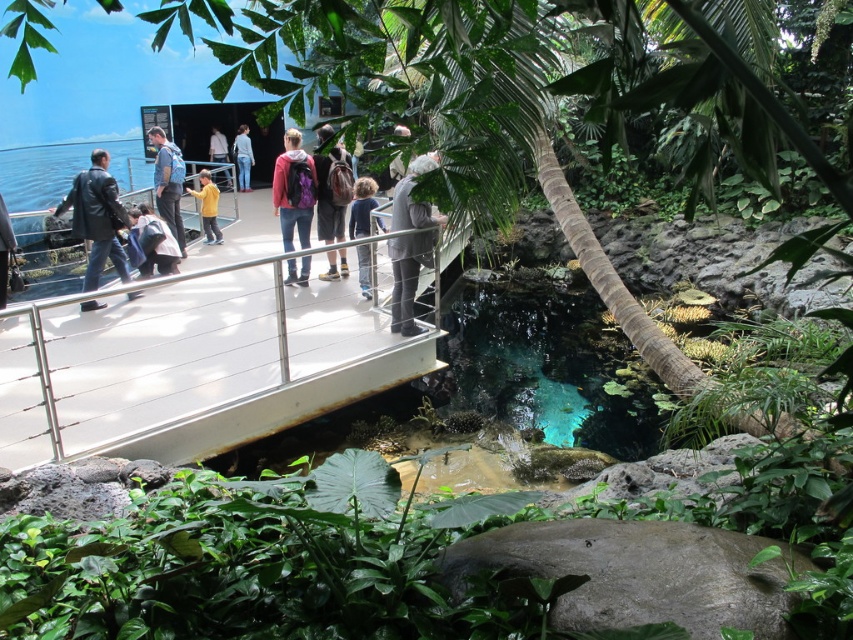
Question: Based on their relative distances, which object is farther from the matte black backpack at center?

Choices:
 (A) blue jeans at center
 (B) light blue backpack at center

Answer: (B)

Question: Can you confirm if dark gray backpack at center is bigger than light blue backpack at center?

Choices:
 (A) no
 (B) yes

Answer: (B)

Question: Can you confirm if dark gray backpack at center is positioned to the left of yellow matte shirt at center?

Choices:
 (A) no
 (B) yes

Answer: (A)

Question: Which object is closer to the camera taking this photo?

Choices:
 (A) purple backpack at center
 (B) light blue backpack at center
 (C) leather jacket at left

Answer: (C)

Question: Does leather jacket at left have a greater width compared to light blue backpack at center?

Choices:
 (A) no
 (B) yes

Answer: (B)

Question: Which object is farther from the camera taking this photo?

Choices:
 (A) matte black backpack at center
 (B) dark gray backpack at center
 (C) purple backpack at center
 (D) matte blue backpack at center

Answer: (D)